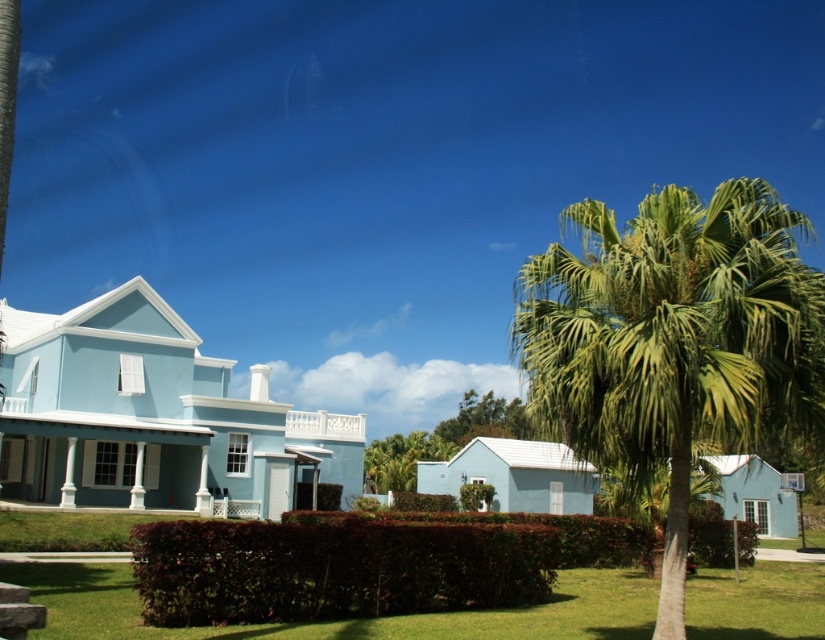
Based on the photo, is green grass at lower center positioned in front of green leafy tree at center?

Yes, it is in front of green leafy tree at center.

Locate an element on the screen. green grass at lower center is located at coordinates (347, 620).

Find the location of a particular element. Image resolution: width=825 pixels, height=640 pixels. green grass at lower center is located at coordinates click(x=347, y=620).

Where is `green grass at lower center`? This screenshot has height=640, width=825. green grass at lower center is located at coordinates (347, 620).

Does point (248, 541) lie behind point (383, 449)?

No, (248, 541) is closer to viewer.

Can you confirm if dark green leafy hedge at center is positioned below green leafy tree at center?

Actually, dark green leafy hedge at center is above green leafy tree at center.

Which is in front, point (152, 600) or point (418, 432)?

Point (152, 600) is in front.

You are a GUI agent. You are given a task and a screenshot of the screen. Output one action in this format:
    pyautogui.click(x=<x>, y=<y>)
    Task: Click on the dark green leafy hedge at center
    The width and height of the screenshot is (825, 640).
    Given the screenshot: What is the action you would take?
    333,568

Based on the photo, can you confirm if green leafy palm tree at right is shorter than green leafy tree at center?

No, green leafy palm tree at right is not shorter than green leafy tree at center.

Can you confirm if green leafy palm tree at right is bigger than green leafy tree at center?

Yes, green leafy palm tree at right is bigger than green leafy tree at center.

Identify the location of green leafy palm tree at right. (673, 339).

Identify the location of green leafy palm tree at right. (673, 339).